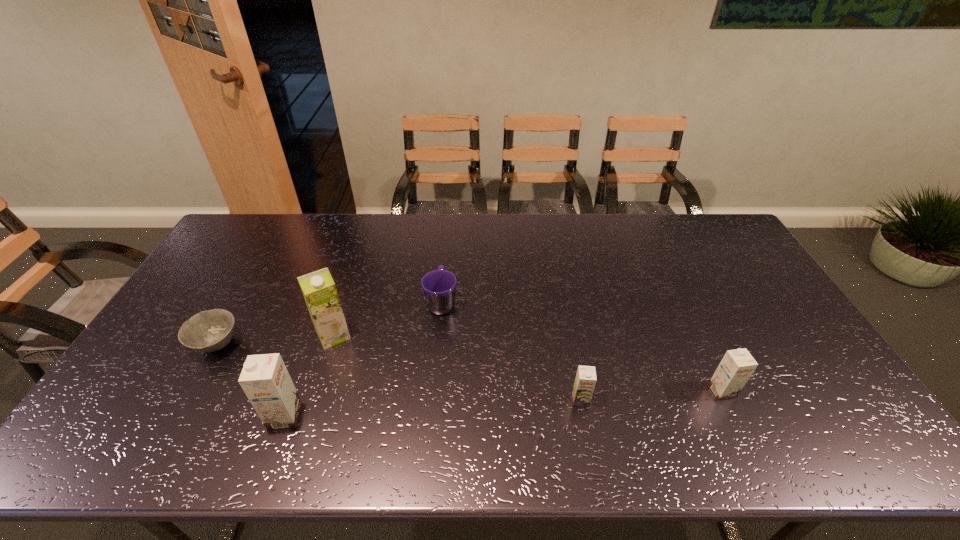
Where is `free region located 0.280m on the back of the tallest chocolate milk`? free region located 0.280m on the back of the tallest chocolate milk is located at coordinates (320, 320).

Locate an element on the screen. free space located on the right of the fifth object from left to right is located at coordinates pos(663,400).

Where is `blank area located on the right of the second shortest chocolate milk`? blank area located on the right of the second shortest chocolate milk is located at coordinates (767, 392).

Where is `free space located 0.200m on the right of the bowl`? free space located 0.200m on the right of the bowl is located at coordinates (312, 344).

The width and height of the screenshot is (960, 540). I want to click on blank space located with the handle on the side of the fourth object from left to right, so click(445, 262).

Identify the location of free space located with the handle on the side of the fourth object from left to right. The width and height of the screenshot is (960, 540). (448, 227).

At what (x,y) coordinates should I click in order to perform the action: click on free space located 0.390m with the handle on the side of the fourth object from left to right. Please return your answer as a coordinate pair (x, y). The height and width of the screenshot is (540, 960). Looking at the image, I should click on (449, 218).

Where is `vacant space located on the back of the soya milk`? vacant space located on the back of the soya milk is located at coordinates (351, 279).

Where is `object present at the left edge`? The image size is (960, 540). object present at the left edge is located at coordinates (208, 331).

This screenshot has width=960, height=540. What are the coordinates of `free space at the far edge of the desktop` in the screenshot? It's located at (641, 240).